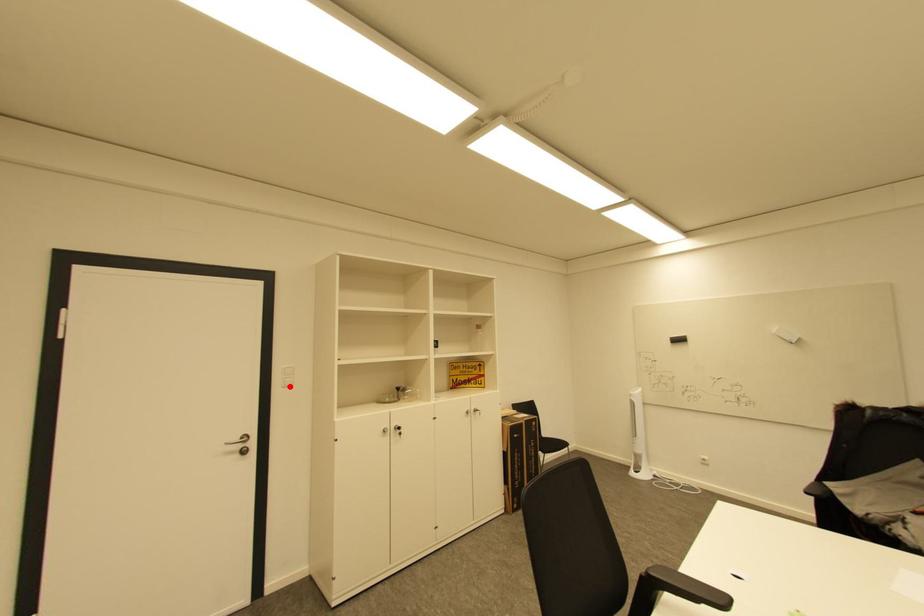
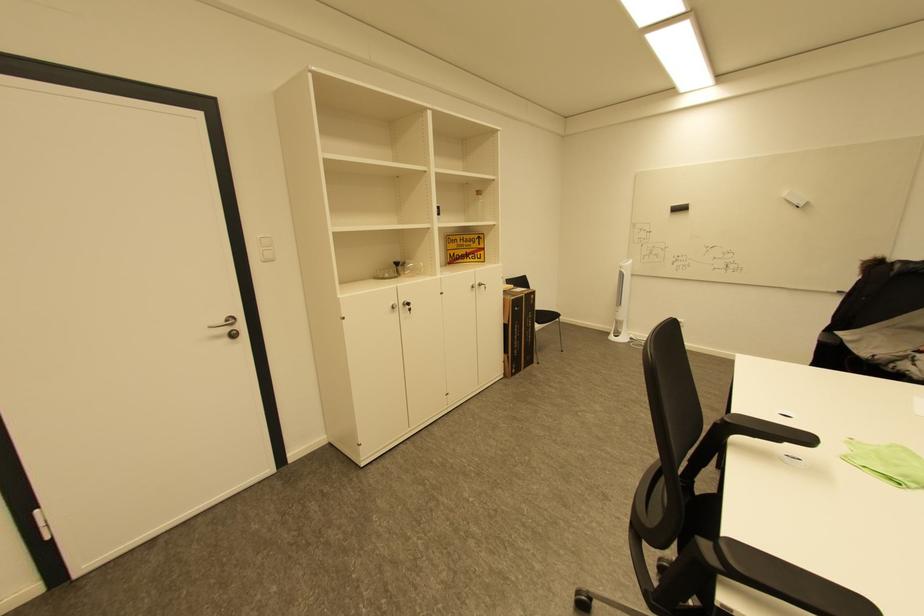
Find the pixel in the second image that matches the highlighted location in the first image.

(270, 261)